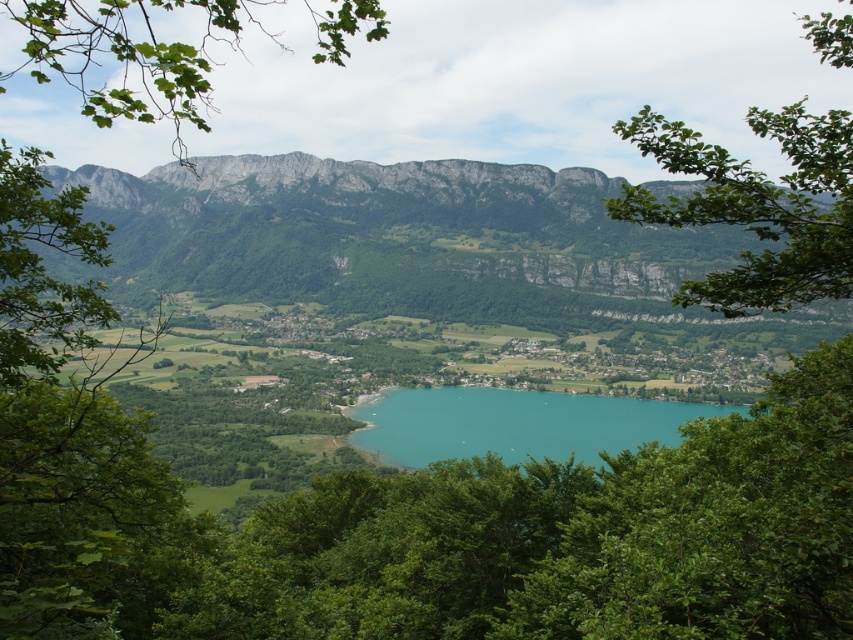
Does green leafy branch at upper right appear on the left side of turquoise glassy water at center?

Incorrect, green leafy branch at upper right is not on the left side of turquoise glassy water at center.

Who is shorter, green leafy branch at upper right or turquoise glassy water at center?

turquoise glassy water at center

What are the coordinates of `green leafy branch at upper right` in the screenshot? It's located at pos(756,205).

Can you confirm if gray rocky mountain at center is positioned to the right of turquoise glassy water at center?

In fact, gray rocky mountain at center is to the left of turquoise glassy water at center.

Looking at this image, which of these two, gray rocky mountain at center or turquoise glassy water at center, stands taller?

gray rocky mountain at center

The width and height of the screenshot is (853, 640). Find the location of `gray rocky mountain at center`. gray rocky mountain at center is located at coordinates (393, 236).

Locate an element on the screen. The image size is (853, 640). gray rocky mountain at center is located at coordinates click(x=393, y=236).

Which is behind, point (123, 237) or point (729, 282)?

Point (123, 237)

Which is more to the right, gray rocky mountain at center or green leafy branch at upper right?

green leafy branch at upper right

What are the coordinates of `gray rocky mountain at center` in the screenshot? It's located at (393, 236).